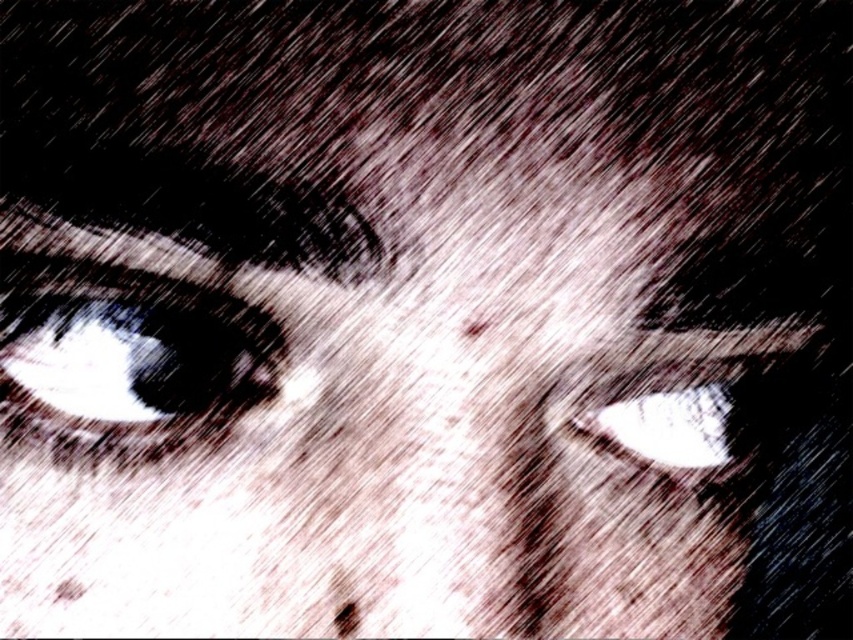
Is point (111, 337) positioned before point (605, 419)?

Yes, it is in front of point (605, 419).

Describe the element at coordinates (128, 355) in the screenshot. I see `shiny black eye at left` at that location.

This screenshot has width=853, height=640. I want to click on shiny black eye at left, so click(x=128, y=355).